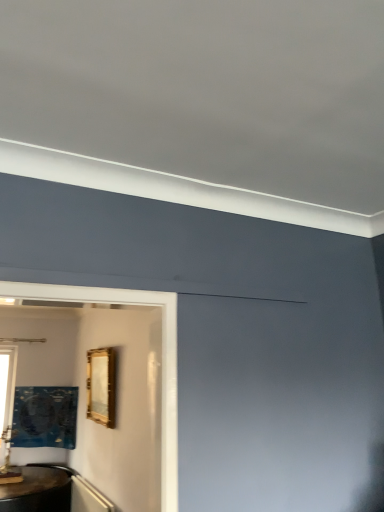
Question: Is gold metallic picture frame at center, placed as the 2th picture frame when sorted from back to front, in front of or behind metallic gold picture frame at lower left, the 2th picture frame in the front-to-back sequence, in the image?

Choices:
 (A) front
 (B) behind

Answer: (A)

Question: In terms of size, does gold metallic picture frame at center, the second picture frame in the bottom-to-top sequence, appear bigger or smaller than metallic gold picture frame at lower left, positioned as the second picture frame in right-to-left order?

Choices:
 (A) small
 (B) big

Answer: (A)

Question: Estimate the real-world distances between objects in this image. Which object is farther from the gold metallic picture frame at center, acting as the first picture frame starting from the right?

Choices:
 (A) metallic gold picture frame at lower left, the 1th picture frame from the bottom
 (B) clear glass window at left

Answer: (B)

Question: Considering the real-world distances, which object is farthest from the metallic gold picture frame at lower left, the 1th picture frame in the left-to-right sequence?

Choices:
 (A) gold metallic picture frame at center, acting as the first picture frame starting from the right
 (B) clear glass window at left

Answer: (A)